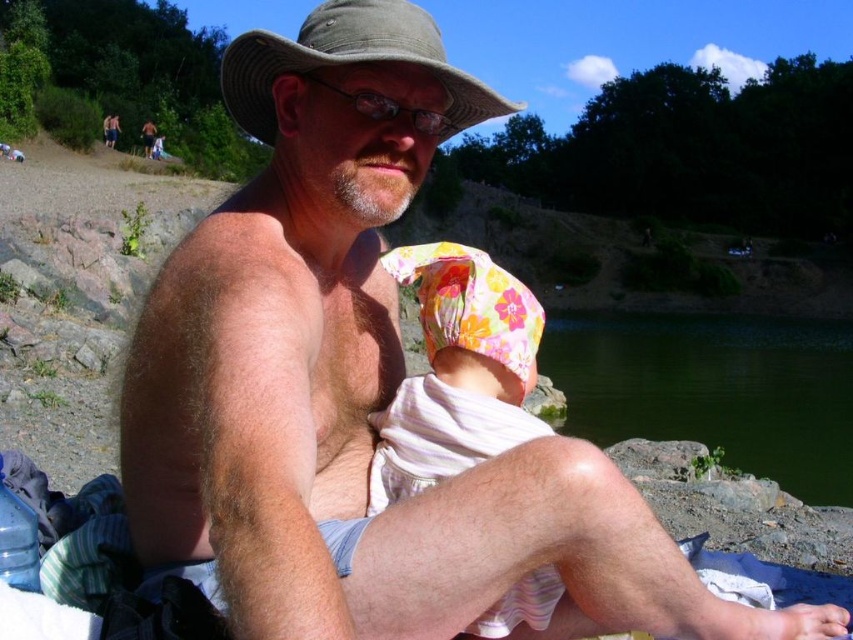
Question: Is green water at lower center positioned before floral fabric baby at center?

Choices:
 (A) no
 (B) yes

Answer: (A)

Question: Can you confirm if floral fabric baby at center is thinner than khaki fabric hat at upper center?

Choices:
 (A) no
 (B) yes

Answer: (B)

Question: Is green water at lower center closer to the viewer compared to floral fabric baby at center?

Choices:
 (A) no
 (B) yes

Answer: (A)

Question: Which point is closer to the camera?

Choices:
 (A) (465, 108)
 (B) (804, 364)

Answer: (A)

Question: Which point appears closest to the camera in this image?

Choices:
 (A) (436, 467)
 (B) (440, 52)

Answer: (A)

Question: Among these objects, which one is farthest from the camera?

Choices:
 (A) floral fabric baby at center
 (B) khaki fabric hat at upper center
 (C) green water at lower center

Answer: (C)